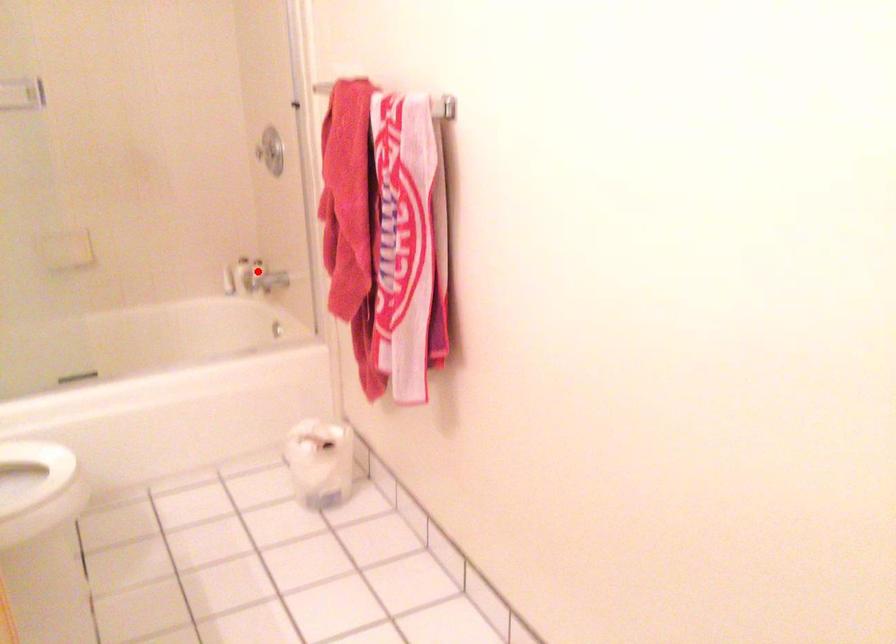
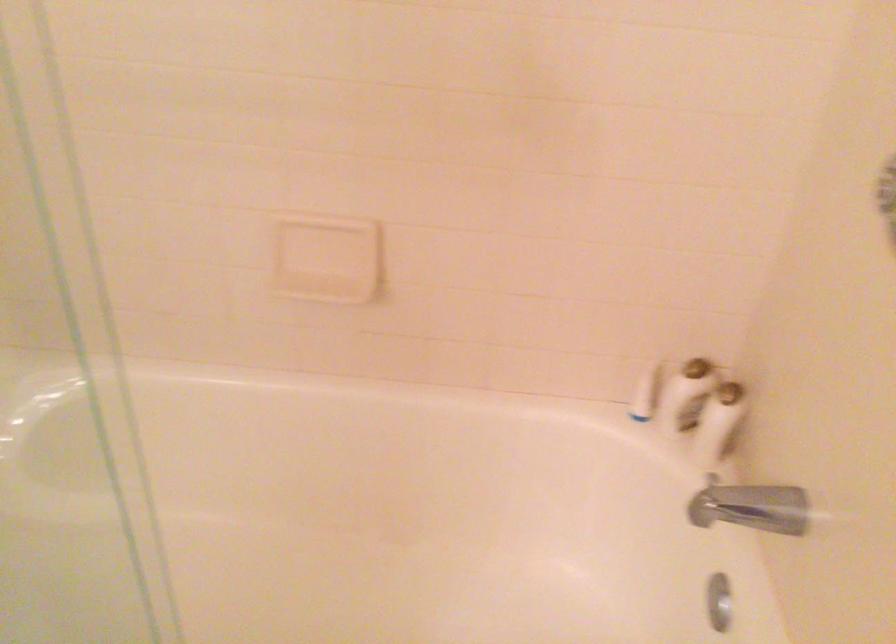
Find the pixel in the second image that matches the highlighted location in the first image.

(718, 422)